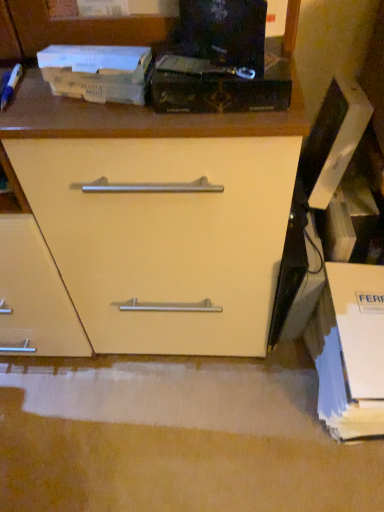
Locate an element on the screen. black matte paperback book at upper center, marked as the 2th paperback book in a left-to-right arrangement is located at coordinates (218, 86).

Where is `black matte paperback book at upper center, which appears as the 1th paperback book when viewed from the right`? This screenshot has height=512, width=384. black matte paperback book at upper center, which appears as the 1th paperback book when viewed from the right is located at coordinates (218, 86).

Is black matte paperback book at upper center, which appears as the 1th paperback book when viewed from the right, oriented away from brown cardboard book at upper left, arranged as the 2th paperback book when viewed from the right?

black matte paperback book at upper center, which appears as the 1th paperback book when viewed from the right, does not have its back to brown cardboard book at upper left, arranged as the 2th paperback book when viewed from the right.

From a real-world perspective, between black matte paperback book at upper center, which appears as the 1th paperback book when viewed from the right, and brown cardboard book at upper left, placed as the first paperback book when sorted from left to right, who is vertically lower?

From a 3D spatial view, black matte paperback book at upper center, which appears as the 1th paperback book when viewed from the right, is below.

Which of these two, black matte paperback book at upper center, marked as the 2th paperback book in a left-to-right arrangement, or brown cardboard book at upper left, placed as the first paperback book when sorted from left to right, is smaller?

Smaller between the two is brown cardboard book at upper left, placed as the first paperback book when sorted from left to right.

From the image's perspective, which is above, brown cardboard book at upper left, placed as the first paperback book when sorted from left to right, or white cardboard box at lower right?

brown cardboard book at upper left, placed as the first paperback book when sorted from left to right.

Where is `the 1st paperback book in front of the white cardboard box at lower right`? The image size is (384, 512). the 1st paperback book in front of the white cardboard box at lower right is located at coordinates (97, 72).

Is white cardboard box at lower right inside brown cardboard book at upper left, placed as the first paperback book when sorted from left to right?

Definitely not — white cardboard box at lower right is not inside brown cardboard book at upper left, placed as the first paperback book when sorted from left to right.

Is black matte paperback book at upper center, which appears as the 1th paperback book when viewed from the right, inside white cardboard box at lower right?

Actually, black matte paperback book at upper center, which appears as the 1th paperback book when viewed from the right, is outside white cardboard box at lower right.

From the image's perspective, which is above, white cardboard box at lower right or black matte paperback book at upper center, marked as the 2th paperback book in a left-to-right arrangement?

black matte paperback book at upper center, marked as the 2th paperback book in a left-to-right arrangement, is shown above in the image.

How distant is white cardboard box at lower right from black matte paperback book at upper center, marked as the 2th paperback book in a left-to-right arrangement?

white cardboard box at lower right is 22.92 inches away from black matte paperback book at upper center, marked as the 2th paperback book in a left-to-right arrangement.

Can you confirm if white cardboard box at lower right is shorter than black matte paperback book at upper center, marked as the 2th paperback book in a left-to-right arrangement?

→ In fact, white cardboard box at lower right may be taller than black matte paperback book at upper center, marked as the 2th paperback book in a left-to-right arrangement.

Between white cardboard box at lower right and brown cardboard book at upper left, arranged as the 2th paperback book when viewed from the right, which one appears on the right side from the viewer's perspective?

white cardboard box at lower right is more to the right.

Could you tell me if white cardboard box at lower right is turned towards brown cardboard book at upper left, placed as the first paperback book when sorted from left to right?

No, white cardboard box at lower right is not facing towards brown cardboard book at upper left, placed as the first paperback book when sorted from left to right.

Is white cardboard box at lower right surrounding brown cardboard book at upper left, arranged as the 2th paperback book when viewed from the right?

That's incorrect, brown cardboard book at upper left, arranged as the 2th paperback book when viewed from the right, is not inside white cardboard box at lower right.

Is white cardboard box at lower right wider than brown cardboard book at upper left, arranged as the 2th paperback book when viewed from the right?

Yes, white cardboard box at lower right is wider than brown cardboard book at upper left, arranged as the 2th paperback book when viewed from the right.

Relative to white cardboard box at lower right, is black matte paperback book at upper center, which appears as the 1th paperback book when viewed from the right, in front or behind?

Visually, black matte paperback book at upper center, which appears as the 1th paperback book when viewed from the right, is located in front of white cardboard box at lower right.

The image size is (384, 512). I want to click on cardboard box directly beneath the black matte paperback book at upper center, which appears as the 1th paperback book when viewed from the right (from a real-world perspective), so click(350, 350).

From a real-world perspective, which is physically below, black matte paperback book at upper center, which appears as the 1th paperback book when viewed from the right, or white cardboard box at lower right?

white cardboard box at lower right.

Does point (241, 94) come behind point (344, 405)?

No, (241, 94) is in front of (344, 405).

Are brown cardboard book at upper left, placed as the first paperback book when sorted from left to right, and black matte paperback book at upper center, marked as the 2th paperback book in a left-to-right arrangement, making contact?

Yes, brown cardboard book at upper left, placed as the first paperback book when sorted from left to right, is next to black matte paperback book at upper center, marked as the 2th paperback book in a left-to-right arrangement.

Between point (128, 72) and point (218, 71), which one is positioned behind?

The point (128, 72) is more distant.

This screenshot has height=512, width=384. Identify the location of paperback book on the left of the black matte paperback book at upper center, which appears as the 1th paperback book when viewed from the right. pyautogui.click(x=97, y=72).

Can you confirm if brown cardboard book at upper left, placed as the first paperback book when sorted from left to right, is wider than black matte paperback book at upper center, which appears as the 1th paperback book when viewed from the right?

In fact, brown cardboard book at upper left, placed as the first paperback book when sorted from left to right, might be narrower than black matte paperback book at upper center, which appears as the 1th paperback book when viewed from the right.

Locate an element on the screen. The image size is (384, 512). paperback book on the right of brown cardboard book at upper left, placed as the first paperback book when sorted from left to right is located at coordinates (218, 86).

Find the location of a particular element. The height and width of the screenshot is (512, 384). cardboard box directly beneath the brown cardboard book at upper left, placed as the first paperback book when sorted from left to right (from a real-world perspective) is located at coordinates (350, 350).

Considering their positions, is black matte paperback book at upper center, which appears as the 1th paperback book when viewed from the right, positioned further to white cardboard box at lower right than brown cardboard book at upper left, arranged as the 2th paperback book when viewed from the right?

brown cardboard book at upper left, arranged as the 2th paperback book when viewed from the right, is positioned further to the anchor white cardboard box at lower right.

Which object lies further to the anchor point black matte paperback book at upper center, marked as the 2th paperback book in a left-to-right arrangement, white cardboard box at lower right or brown cardboard book at upper left, arranged as the 2th paperback book when viewed from the right?

white cardboard box at lower right lies further to black matte paperback book at upper center, marked as the 2th paperback book in a left-to-right arrangement, than the other object.

Based on their spatial positions, is black matte paperback book at upper center, which appears as the 1th paperback book when viewed from the right, or white cardboard box at lower right closer to brown cardboard book at upper left, arranged as the 2th paperback book when viewed from the right?

black matte paperback book at upper center, which appears as the 1th paperback book when viewed from the right, is positioned closer to the anchor brown cardboard book at upper left, arranged as the 2th paperback book when viewed from the right.

Which object lies further to the anchor point white cardboard box at lower right, brown cardboard book at upper left, placed as the first paperback book when sorted from left to right, or black matte paperback book at upper center, marked as the 2th paperback book in a left-to-right arrangement?

brown cardboard book at upper left, placed as the first paperback book when sorted from left to right, is positioned further to the anchor white cardboard box at lower right.

Estimate the real-world distances between objects in this image. Which object is closer to black matte paperback book at upper center, marked as the 2th paperback book in a left-to-right arrangement, brown cardboard book at upper left, placed as the first paperback book when sorted from left to right, or white cardboard box at lower right?

brown cardboard book at upper left, placed as the first paperback book when sorted from left to right, is closer to black matte paperback book at upper center, marked as the 2th paperback book in a left-to-right arrangement.

Considering their positions, is white cardboard box at lower right positioned closer to brown cardboard book at upper left, placed as the first paperback book when sorted from left to right, than black matte paperback book at upper center, which appears as the 1th paperback book when viewed from the right?

black matte paperback book at upper center, which appears as the 1th paperback book when viewed from the right, lies closer to brown cardboard book at upper left, placed as the first paperback book when sorted from left to right, than the other object.

The height and width of the screenshot is (512, 384). I want to click on paperback book between black matte paperback book at upper center, marked as the 2th paperback book in a left-to-right arrangement, and white cardboard box at lower right vertically, so click(x=97, y=72).